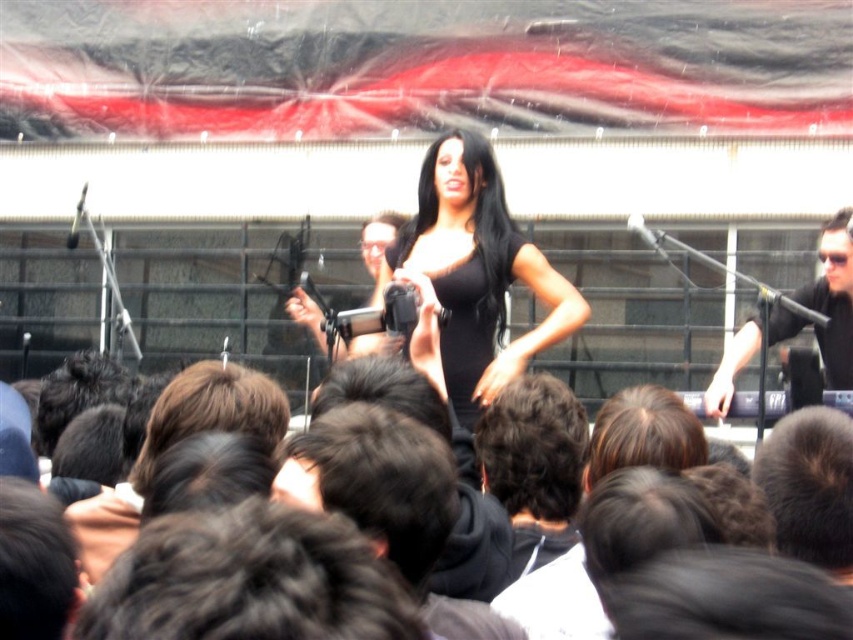
You are a stagehand setting up for a performance. You need to adjust the microphone positions so that the matte black microphone at center is directly in front of the performer. Given that the metallic silver microphone at upper center is already positioned where it needs to be, which microphone should you move and in which direction?

You should move the matte black microphone at center to the right so that it aligns directly in front of the performer, as it is currently to the left of the metallic silver microphone at upper center which is correctly positioned.

You are a photographer at the event and want to capture a shot of the performer. Since you can only focus on one object, which one should you choose to ensure the metallic silver microphone at upper center and the black shiny hair at center are both in the frame?

The metallic silver microphone at upper center is positioned on the right side of black shiny hair at center, so focusing on the black shiny hair at center would keep both objects in the frame as they are close together.